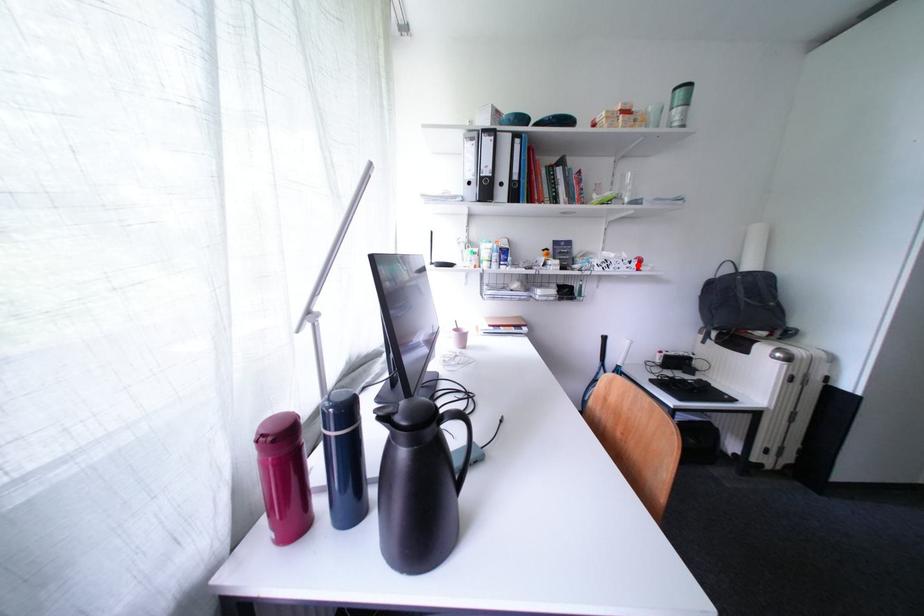
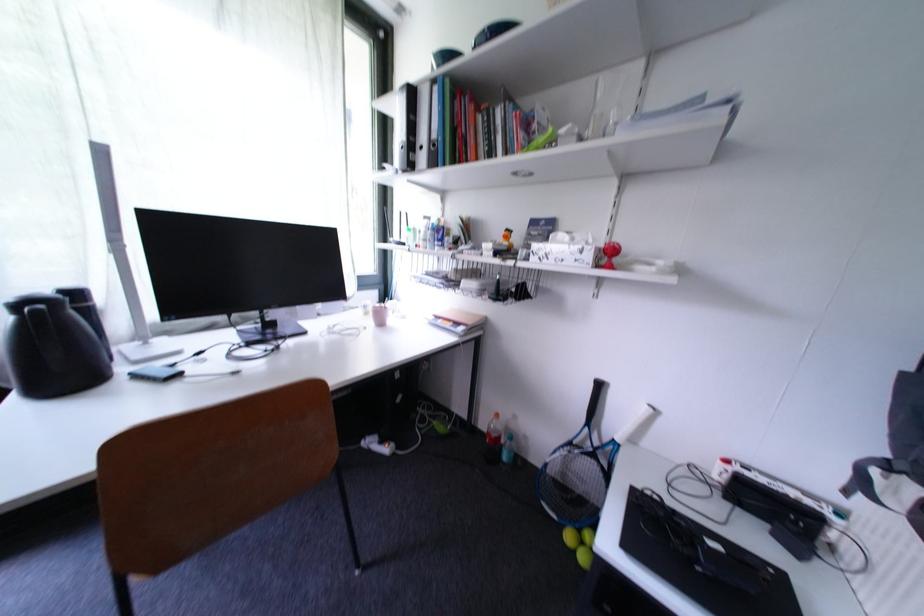
In the second image, find the point that corresponds to the highlighted location in the first image.

(590, 253)